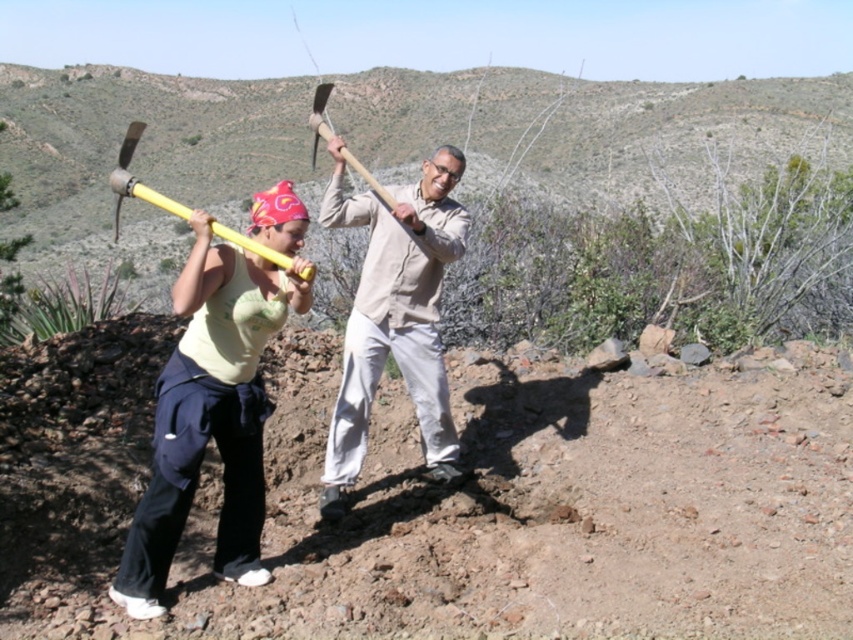
Question: Which of the following is the closest to the observer?

Choices:
 (A) light beige fabric shirt at center
 (B) yellow plastic ax at upper center
 (C) wooden handle axe at center

Answer: (B)

Question: In this image, where is light beige fabric shirt at center located relative to yellow plastic ax at upper center?

Choices:
 (A) below
 (B) above

Answer: (A)

Question: Considering the real-world distances, which object is closest to the wooden handle axe at center?

Choices:
 (A) light beige fabric shirt at center
 (B) yellow plastic pickaxe at center

Answer: (A)

Question: Observing the image, what is the correct spatial positioning of yellow plastic pickaxe at center in reference to light beige fabric shirt at center?

Choices:
 (A) left
 (B) right

Answer: (A)

Question: Is yellow plastic pickaxe at center bigger than light beige fabric shirt at center?

Choices:
 (A) no
 (B) yes

Answer: (A)

Question: Among these objects, which one is farthest from the camera?

Choices:
 (A) wooden handle axe at center
 (B) yellow plastic ax at upper center
 (C) light beige fabric shirt at center
 (D) yellow plastic pickaxe at center

Answer: (A)